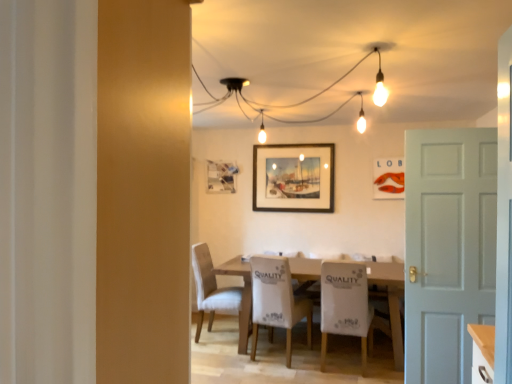
Question: Is wooden framed painting at center, the second picture frame positioned from the back, at the back of white fabric chair at center, placed as the third chair when sorted from left to right?

Choices:
 (A) no
 (B) yes

Answer: (A)

Question: Is wooden framed painting at center, arranged as the second picture frame when viewed from the right, inside white fabric chair at center, placed as the third chair when sorted from left to right?

Choices:
 (A) yes
 (B) no

Answer: (B)

Question: From a real-world perspective, is white fabric chair at center, placed as the third chair when sorted from left to right, beneath wooden framed painting at center, positioned as the second picture frame in left-to-right order?

Choices:
 (A) no
 (B) yes

Answer: (B)

Question: Is white fabric chair at center, placed as the third chair when sorted from left to right, at the left side of wooden framed painting at center, positioned as the second picture frame in left-to-right order?

Choices:
 (A) no
 (B) yes

Answer: (A)

Question: Is white fabric chair at center, placed as the third chair when sorted from left to right, wider than wooden framed painting at center, the second picture frame positioned from the back?

Choices:
 (A) no
 (B) yes

Answer: (B)

Question: Relative to white matte door at right, is matte orange lobster at upper center, placed as the 3th picture frame when sorted from left to right, in front or behind?

Choices:
 (A) front
 (B) behind

Answer: (B)

Question: In terms of width, does matte orange lobster at upper center, which is the 1th picture frame in front-to-back order, look wider or thinner when compared to white matte door at right?

Choices:
 (A) wide
 (B) thin

Answer: (B)

Question: Is matte orange lobster at upper center, placed as the 3th picture frame when sorted from left to right, situated inside white matte door at right or outside?

Choices:
 (A) outside
 (B) inside

Answer: (A)

Question: Is matte orange lobster at upper center, which is the 1th picture frame in front-to-back order, taller or shorter than white matte door at right?

Choices:
 (A) tall
 (B) short

Answer: (B)

Question: In the image, is white matte door at right positioned in front of or behind matte glass picture frame at center, which appears as the third picture frame when viewed from the right?

Choices:
 (A) behind
 (B) front

Answer: (B)

Question: Is white matte door at right wider or thinner than matte glass picture frame at center, which is counted as the 1th picture frame, starting from the back?

Choices:
 (A) wide
 (B) thin

Answer: (A)

Question: Choose the correct answer: Is white matte door at right inside matte glass picture frame at center, acting as the 3th picture frame starting from the front, or outside it?

Choices:
 (A) outside
 (B) inside

Answer: (A)

Question: Is white matte door at right taller or shorter than matte glass picture frame at center, which is counted as the 1th picture frame, starting from the back?

Choices:
 (A) tall
 (B) short

Answer: (A)

Question: Is white fabric chair at center, which is the first chair from right to left, inside or outside of wooden table at center?

Choices:
 (A) outside
 (B) inside

Answer: (B)

Question: In the image, is white fabric chair at center, which is the first chair from right to left, on the left side or the right side of wooden table at center?

Choices:
 (A) left
 (B) right

Answer: (B)